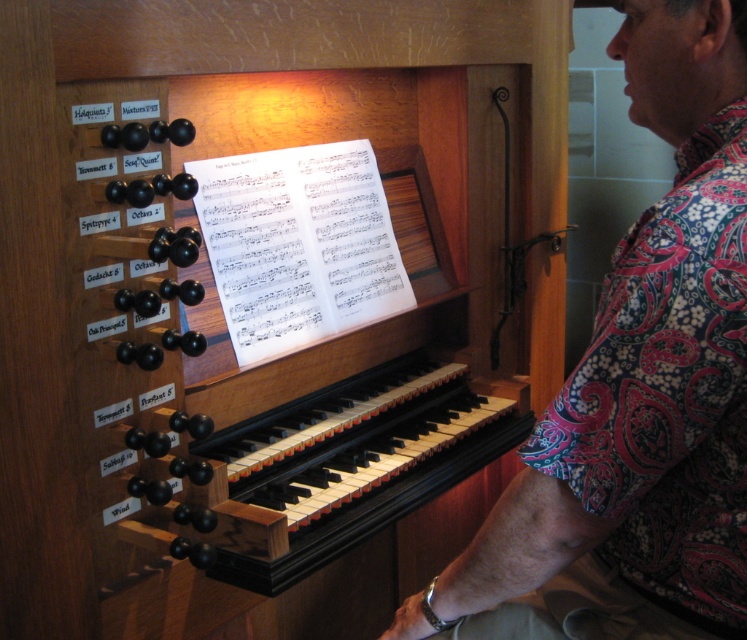
You are standing in front of the organ console and see the floral fabric shirt at right. If you want to reach it without moving your feet, which direction should you stretch your arm towards?

The floral fabric shirt at right is located at point 0.614 on the x axis and 0.855 on the y axis, so you should stretch your arm towards the right and slightly upwards to reach it.

You are a musician preparing to play the organ. You notice a floral fabric shirt at right and a black polished wood keyboard at center. Which object is narrower?

The floral fabric shirt at right has a lesser width compared to the black polished wood keyboard at center, so the floral fabric shirt at right is narrower.

You are a photographer setting up a shot of the organ console. You want to ensure both the floral fabric shirt at right and the black polished wood keyboard at center are in focus. Given that the shirt is smaller than the keyboard, which object should you adjust your focus on first to ensure both are clear?

The floral fabric shirt at right is smaller than the black polished wood keyboard at center, so you should focus on the smaller shirt first to ensure its details are sharp before adjusting for the larger keyboard.